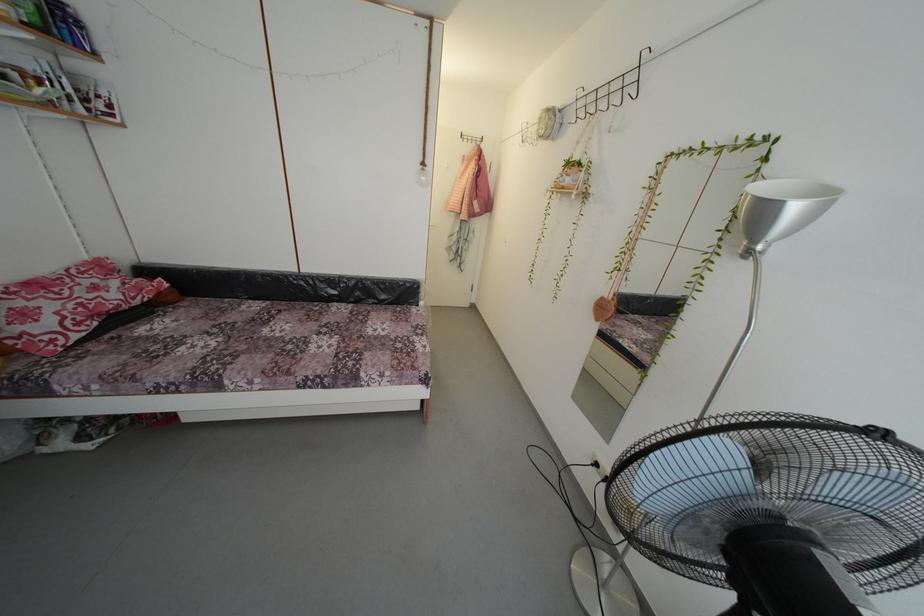
Image resolution: width=924 pixels, height=616 pixels. What do you see at coordinates (781, 209) in the screenshot? I see `the silver lamp head` at bounding box center [781, 209].